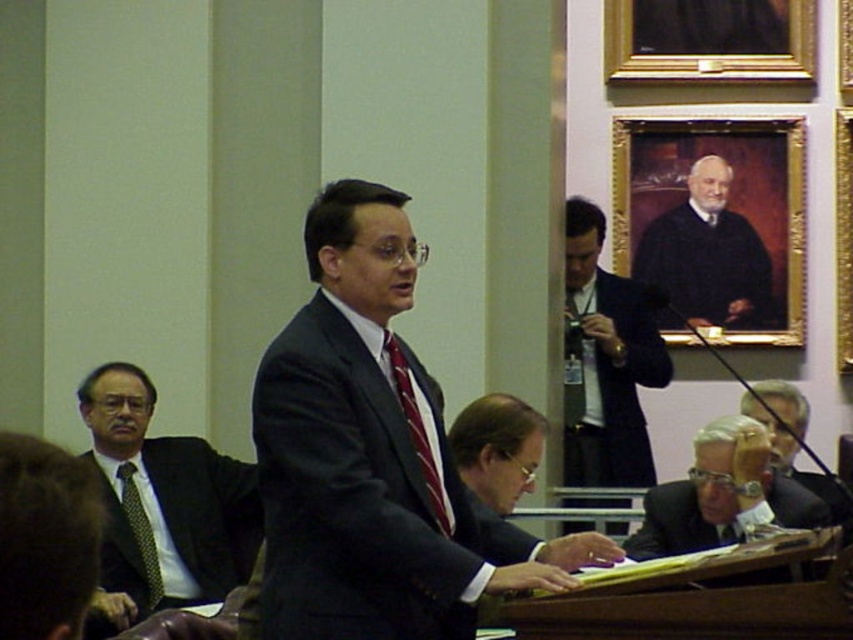
Does matte black suit at left appear over dark blue suit at center?

Actually, matte black suit at left is below dark blue suit at center.

Identify the location of matte black suit at left. (163, 504).

This screenshot has height=640, width=853. What are the coordinates of `matte black suit at left` in the screenshot? It's located at (163, 504).

Find the location of a particular element. This screenshot has height=640, width=853. matte black suit at left is located at coordinates (163, 504).

Can you confirm if gold/gilded picture frame at upper center is wider than dark blue robe at upper center?

Yes, gold/gilded picture frame at upper center is wider than dark blue robe at upper center.

How distant is gold/gilded picture frame at upper center from dark blue robe at upper center?

gold/gilded picture frame at upper center is 6.07 feet away from dark blue robe at upper center.

Which is behind, point (805, 4) or point (656, 230)?

The point (656, 230) is behind.

You are a GUI agent. You are given a task and a screenshot of the screen. Output one action in this format:
    pyautogui.click(x=<x>, y=<y>)
    Task: Click on the gold/gilded picture frame at upper center
    The width and height of the screenshot is (853, 640).
    Given the screenshot: What is the action you would take?
    pyautogui.click(x=709, y=40)

Can you confirm if dark gray suit at center is wider than matte black suit at lower right?

Indeed, dark gray suit at center has a greater width compared to matte black suit at lower right.

Locate an element on the screen. This screenshot has width=853, height=640. dark gray suit at center is located at coordinates (360, 493).

You are a GUI agent. You are given a task and a screenshot of the screen. Output one action in this format:
    pyautogui.click(x=<x>, y=<y>)
    Task: Click on the dark gray suit at center
    This screenshot has height=640, width=853.
    Given the screenshot: What is the action you would take?
    pyautogui.click(x=360, y=493)